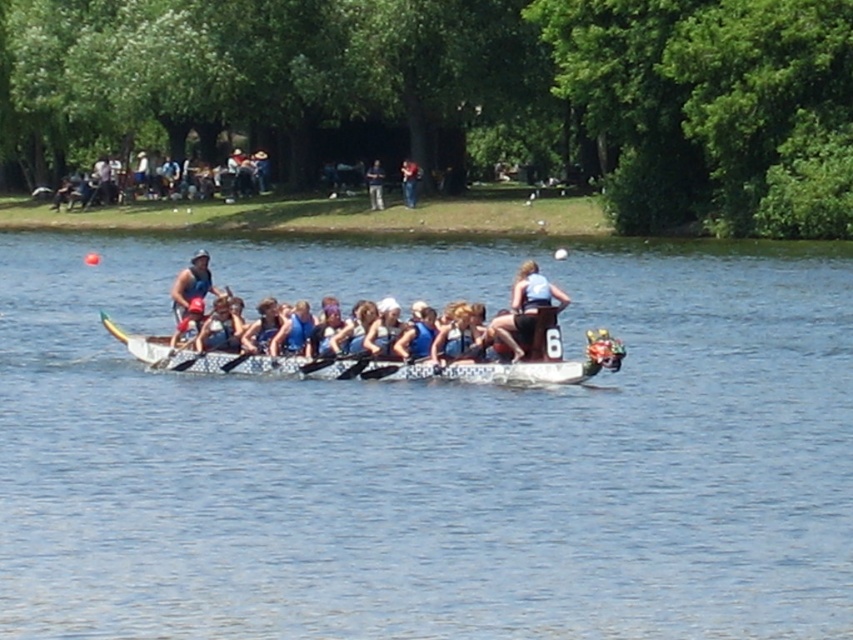
Question: Which point is closer to the camera taking this photo?

Choices:
 (A) (36, 189)
 (B) (122, 332)

Answer: (B)

Question: Which object appears farthest from the camera in this image?

Choices:
 (A) blue fabric boat at upper center
 (B) smooth skin person at center
 (C) black plastic paddle at center
 (D) matte blue shirt at center

Answer: (A)

Question: Among these objects, which one is farthest from the camera?

Choices:
 (A) blue fabric boat at upper center
 (B) matte blue tank top at center
 (C) matte blue shirt at center
 (D) white glossy dragon boat at center

Answer: (A)

Question: Can you confirm if blue fabric boat at upper center is positioned above blue fabric shirt at center?

Choices:
 (A) yes
 (B) no

Answer: (A)

Question: Can you confirm if matte blue shirt at center is bigger than matte blue tank top at center?

Choices:
 (A) no
 (B) yes

Answer: (A)

Question: Can you confirm if matte blue shirt at center is smaller than smooth skin person at center?

Choices:
 (A) no
 (B) yes

Answer: (A)